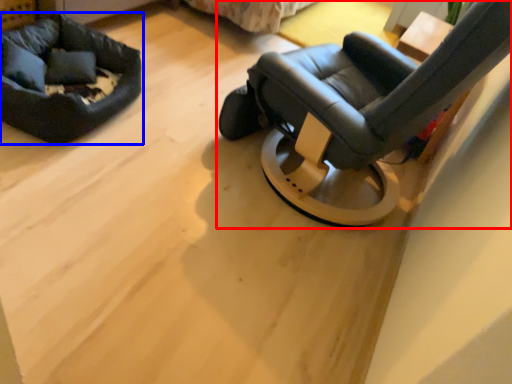
Question: Which object appears farthest to the camera in this image, chair (highlighted by a red box) or dog bed (highlighted by a blue box)?

Choices:
 (A) chair
 (B) dog bed

Answer: (B)